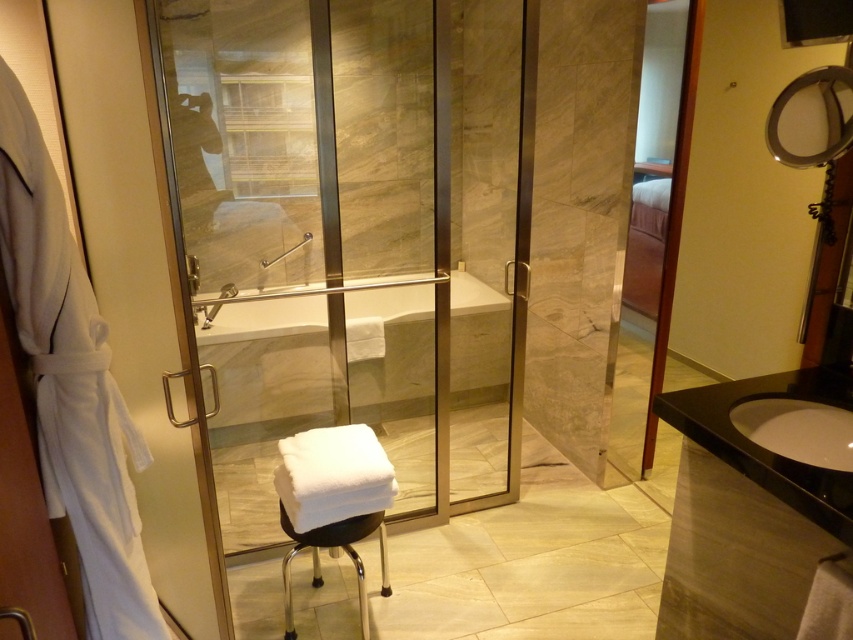
Is transparent glass door at center to the right of white soft bathrobe at left from the viewer's perspective?

Correct, you'll find transparent glass door at center to the right of white soft bathrobe at left.

Measure the distance between transparent glass door at center and white soft bathrobe at left.

transparent glass door at center is 1.70 meters away from white soft bathrobe at left.

You are a GUI agent. You are given a task and a screenshot of the screen. Output one action in this format:
    pyautogui.click(x=<x>, y=<y>)
    Task: Click on the transparent glass door at center
    This screenshot has width=853, height=640.
    Given the screenshot: What is the action you would take?
    pyautogui.click(x=355, y=236)

Does white marble bathtub at center appear over white glossy sink at right?

Yes.

Can you confirm if white marble bathtub at center is positioned below white glossy sink at right?

No.

Identify the location of white marble bathtub at center. This screenshot has height=640, width=853. (265, 317).

Describe the element at coordinates (798, 429) in the screenshot. I see `white glossy sink at right` at that location.

Locate an element on the screen. The width and height of the screenshot is (853, 640). white glossy sink at right is located at coordinates (798, 429).